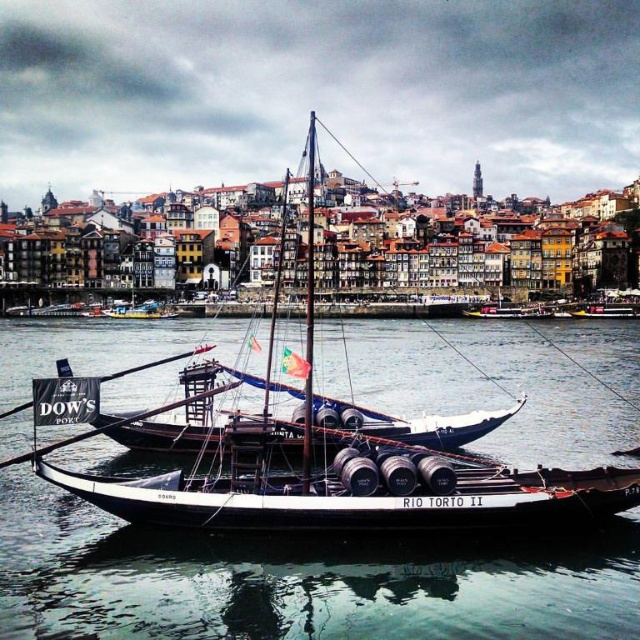
You are a photographer planning to capture the Douro River scene. You want to ensure the clear water at center and wooden barrel boat at center are both visible in your shot. Which object takes up more area in the image?

The wooden barrel boat at center occupies more space than the clear water at center in the image.

From the picture: You are a tourist standing on the dock and want to take a photo of the wooden barrel boat at center. The clear water at center is in the way. Can you see the boat over the water?

The clear water at center is shorter than the wooden barrel boat at center, so yes, you can see the boat over the water since it is taller than the water.

You are standing on the deck of the Rabelo boat named Rio Torto II. You see a point marked at coordinates [300,580]. What is located at this point?

The point at coordinates [300,580] corresponds to clear water at center.